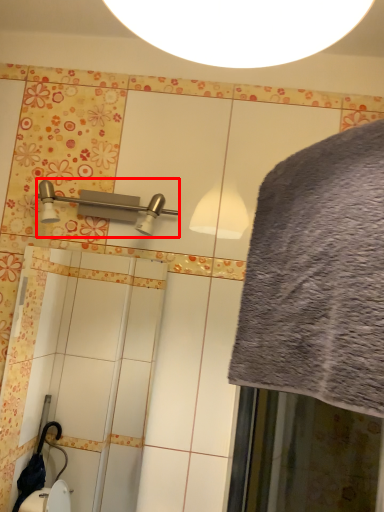
Question: Considering the relative positions of shower (annotated by the red box) and bath towel in the image provided, where is shower (annotated by the red box) located with respect to the staircase?

Choices:
 (A) left
 (B) right

Answer: (A)